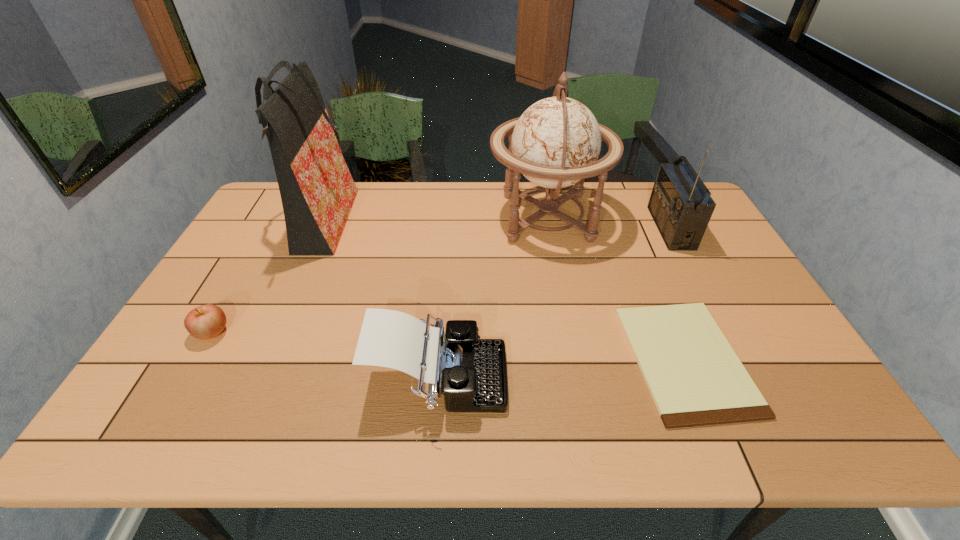
The image size is (960, 540). In the image, there is a desktop. Identify the location of free space at the near edge. (286, 426).

The width and height of the screenshot is (960, 540). In the image, there is a desktop. What are the coordinates of `free region at the right edge` in the screenshot? It's located at (751, 287).

Image resolution: width=960 pixels, height=540 pixels. I want to click on vacant position at the near left corner of the desktop, so click(156, 435).

In order to click on free spot between the apple and the globe in this screenshot , I will do `click(379, 275)`.

Find the location of a particular element. This screenshot has height=540, width=960. free space that is in between the shopping bag and the typewriter is located at coordinates (380, 302).

Identify the location of free point between the third tallest object and the second object from left to right. (496, 226).

You are a GUI agent. You are given a task and a screenshot of the screen. Output one action in this format:
    pyautogui.click(x=<x>, y=<y>)
    Task: Click on the free area in between the third tallest object and the typewriter
    Image resolution: width=960 pixels, height=540 pixels.
    Given the screenshot: What is the action you would take?
    pyautogui.click(x=555, y=304)

Locate an element on the screen. free space between the apple and the fourth tallest object is located at coordinates (325, 356).

At what (x,y) coordinates should I click in order to perform the action: click on unoccupied area between the radio receiver and the globe. Please return your answer as a coordinate pair (x, y). Looking at the image, I should click on (609, 222).

In order to click on unoccupied position between the radio receiver and the globe in this screenshot , I will do `click(609, 222)`.